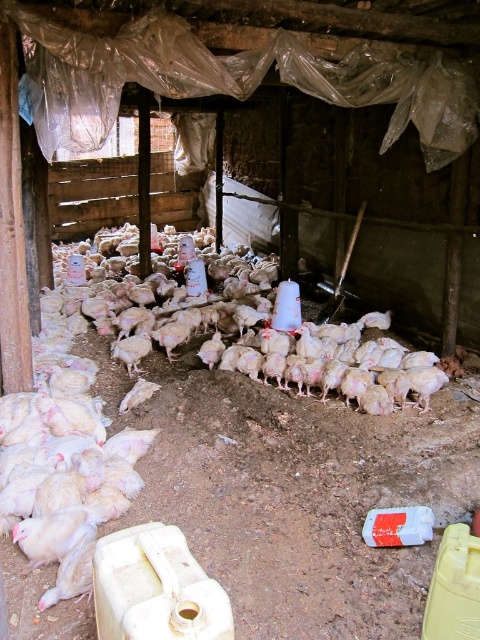
You are a farmer checking the chicken coop. You notice a white feathered chicken at center. Where exactly is this chicken positioned in relation to the white plastic containers in the center of the coop?

The white feathered chicken at center is located at point coordinates of approximately 0.667 on the x axis and 0.383 on the y axis. The white plastic containers are placed on the ground among the chickens in the center of the coop, so the chicken is near the containers in the central area.

You are a farmer checking the chicken coop. You notice two specific points in the coop, one at coordinate point(310,484) and another at point(188,316). Which point is nearer to your current position when you are standing at the front of the coop?

Point(310,484) is closer to the camera than point(188,316), so the point at coordinate point(310,484) is nearer to your current position when you are standing at the front of the coop.